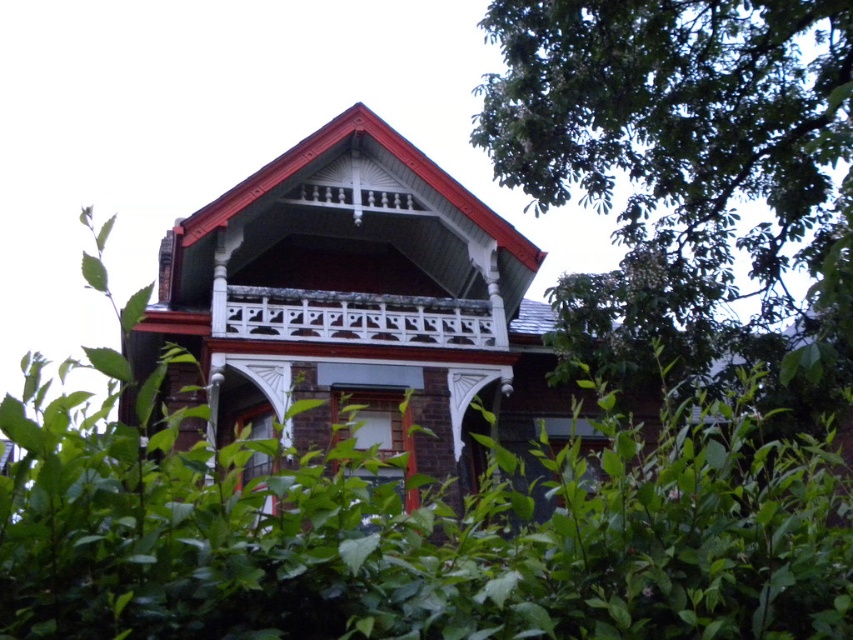
The height and width of the screenshot is (640, 853). Describe the element at coordinates (688, 173) in the screenshot. I see `green leafy tree at upper right` at that location.

The height and width of the screenshot is (640, 853). What do you see at coordinates (688, 173) in the screenshot? I see `green leafy tree at upper right` at bounding box center [688, 173].

You are a GUI agent. You are given a task and a screenshot of the screen. Output one action in this format:
    pyautogui.click(x=<x>, y=<y>)
    Task: Click on the green leafy tree at upper right
    The image size is (853, 640).
    Given the screenshot: What is the action you would take?
    pyautogui.click(x=688, y=173)